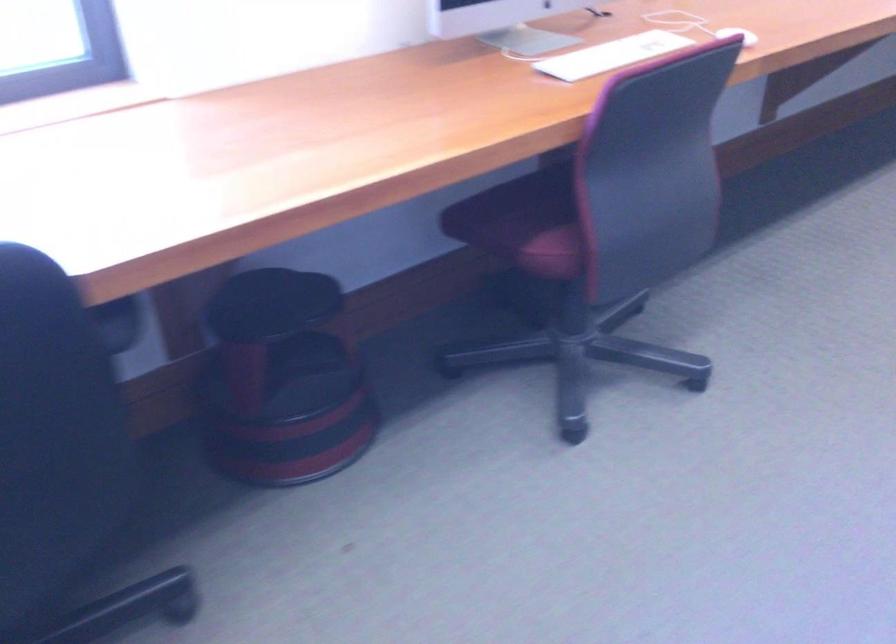
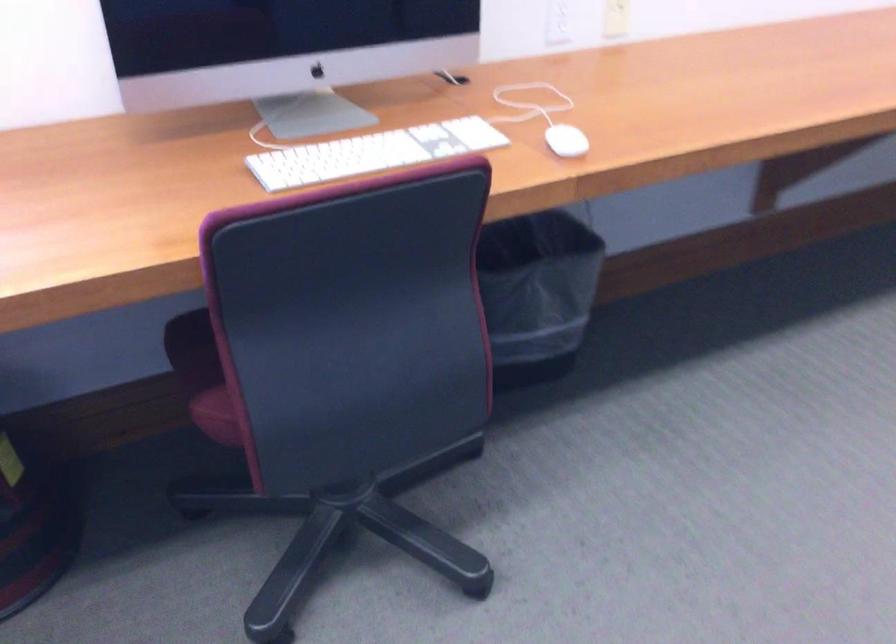
Find the pixel in the second image that matches pixel 547 250 in the first image.

(220, 413)